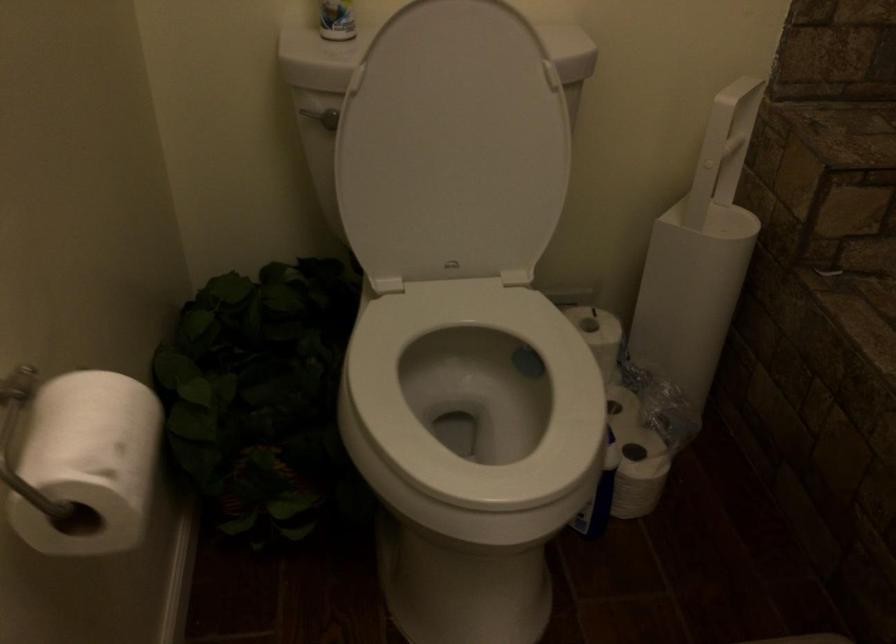
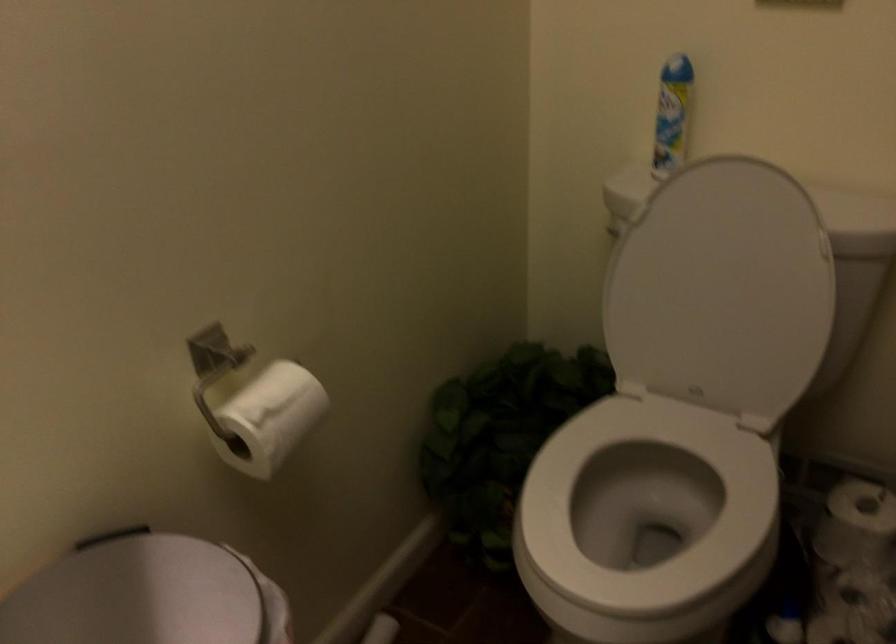
Find the pixel in the second image that matches (125,453) in the first image.

(271, 417)